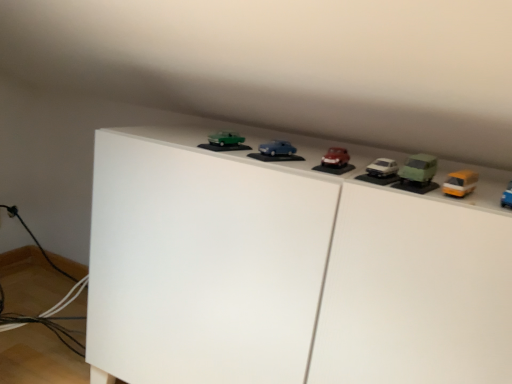
Question: Is point (220, 145) positioned closer to the camera than point (389, 218)?

Choices:
 (A) farther
 (B) closer

Answer: (A)

Question: Considering the positions of green matte car at upper center, which ranks as the 1th toy in left-to-right order, and white matte cabinet at upper center in the image, is green matte car at upper center, which ranks as the 1th toy in left-to-right order, taller or shorter than white matte cabinet at upper center?

Choices:
 (A) tall
 (B) short

Answer: (B)

Question: Estimate the real-world distances between objects in this image. Which object is farther from the white matte cabinet at upper center?

Choices:
 (A) green matte car at right, placed as the second toy when sorted from right to left
 (B) matte red car at center, arranged as the 3th toy when viewed from the left
 (C) green matte car at upper center, the fifth toy positioned from the right
 (D) yellow matte van at upper right, the fifth toy viewed from the left
 (E) matte blue car at center, the 2th toy from the left

Answer: (D)

Question: Based on their relative distances, which object is farther from the white matte cabinet at upper center?

Choices:
 (A) matte red car at center, arranged as the 3th toy when viewed from the left
 (B) yellow matte van at upper right, the first toy from the right
 (C) matte blue car at center, the 2th toy from the left
 (D) green matte car at right, marked as the 4th toy in a left-to-right arrangement
 (E) green matte car at upper center, the fifth toy positioned from the right

Answer: (B)